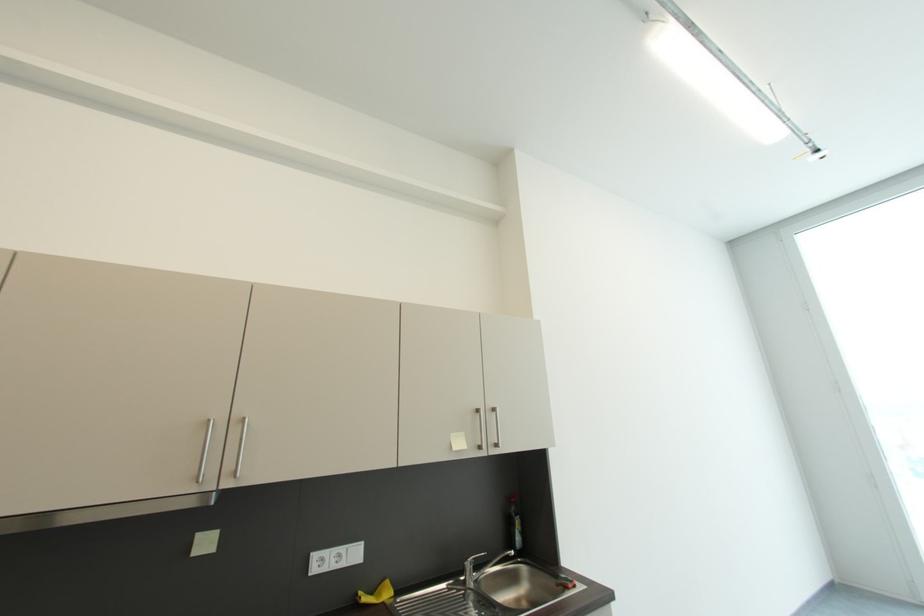
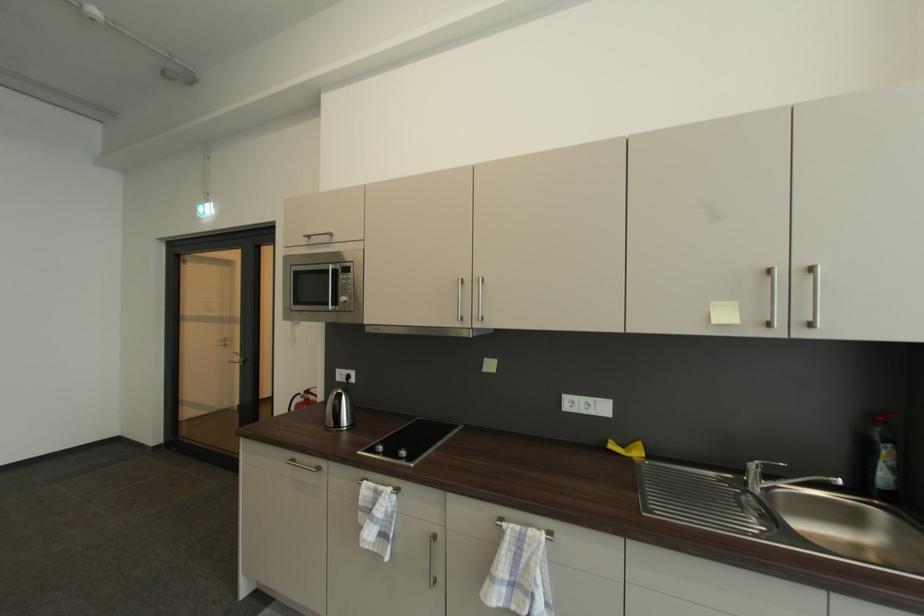
In the second image, find the point that corresponds to pixel 518 501 in the first image.

(885, 419)